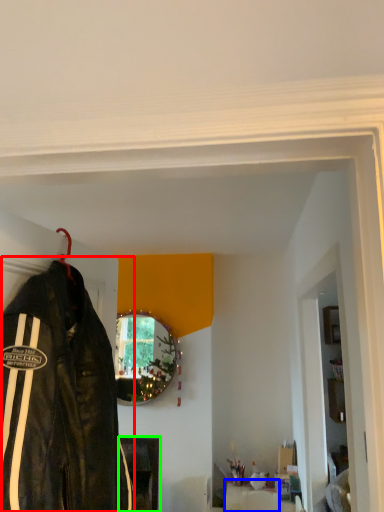
Question: Which object is positioned closest to jacket (highlighted by a red box)? Select from furniture (highlighted by a blue box) and furniture (highlighted by a green box).

Choices:
 (A) furniture
 (B) furniture

Answer: (A)